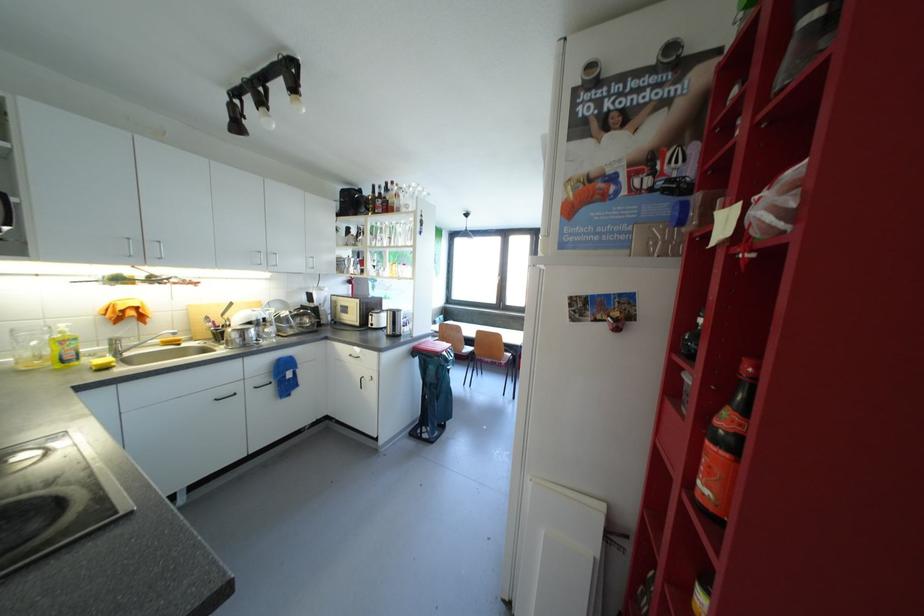
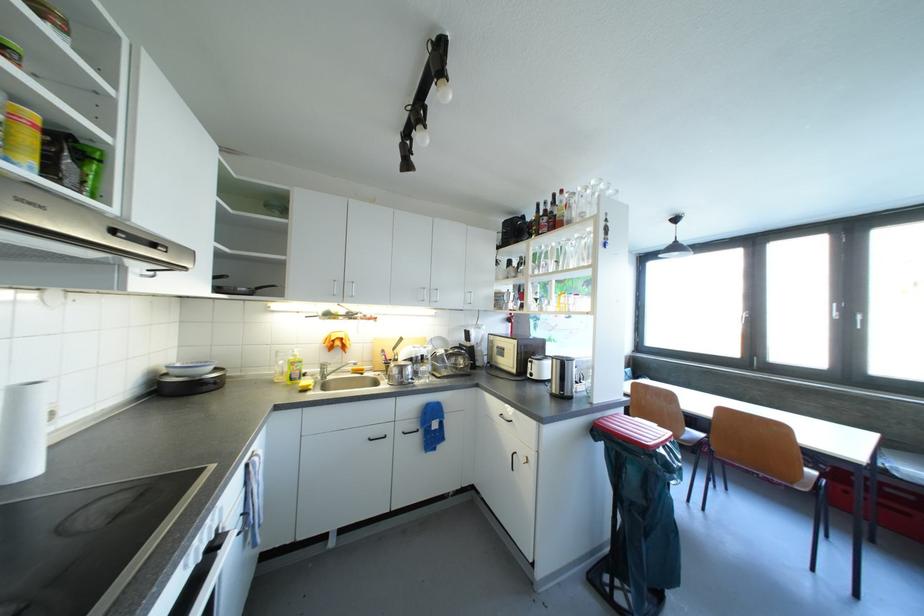
The point at (395, 334) is marked in the first image. Where is the corresponding point in the second image?

(561, 392)